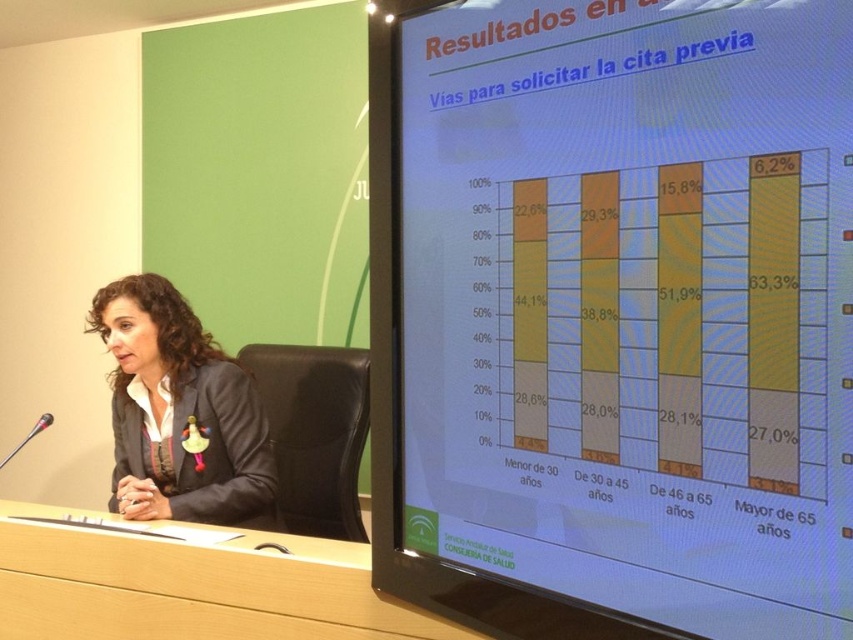
You are an event organizer who needs to check the visibility of the bar chart during a presentation. Considering the setup described, will the matte yellow bar chart at right be visible to the audience seated in front of the wooden at center?

The matte yellow bar chart at right is taller than the wooden at center, so it will be visible to the audience seated in front of the wooden at center because its height surpasses the wooden desk.

You are an assistant who needs to determine if the height of the matte yellow bar chart at right can be seen over the matte gray blazer at center from the front of the desk. Based on the scene description, can you confirm this?

The matte yellow bar chart at right is taller than the matte gray blazer at center, so yes, the bar chart can be seen over the blazer from the front of the desk.